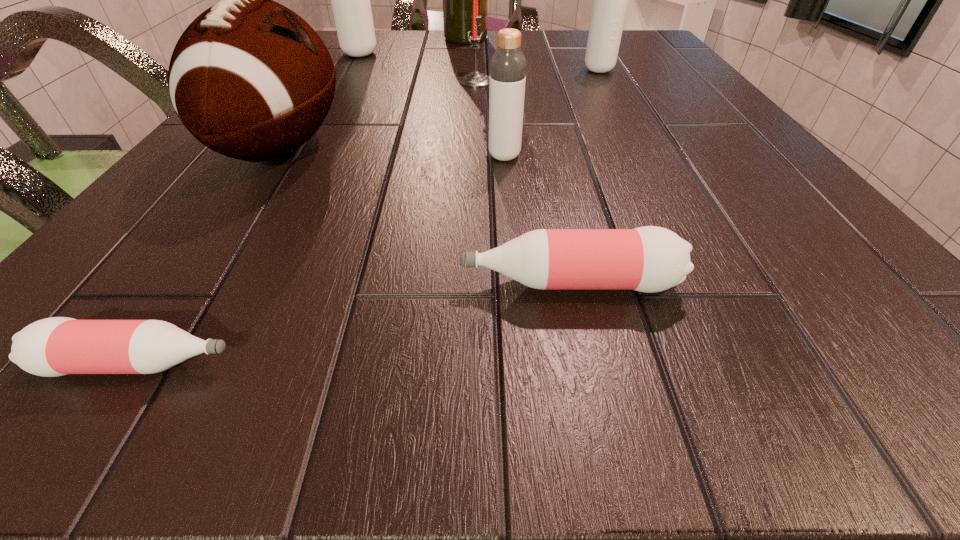
The width and height of the screenshot is (960, 540). In order to click on vacant space located with the cap open on the right pink bottle in this screenshot , I will do `click(380, 283)`.

Locate an element on the screen. free space located 0.050m with the cap open on the right pink bottle is located at coordinates (416, 283).

You are a GUI agent. You are given a task and a screenshot of the screen. Output one action in this format:
    pyautogui.click(x=<x>, y=<y>)
    Task: Click on the vacant space located 0.210m with the cap open on the right pink bottle
    
    Given the screenshot: What is the action you would take?
    272,283

This screenshot has height=540, width=960. Find the location of `free region located 0.170m with the cap open on the nearer pink bottle`. free region located 0.170m with the cap open on the nearer pink bottle is located at coordinates (417, 364).

The height and width of the screenshot is (540, 960). I want to click on wine bottle that is at the far edge, so click(457, 0).

Locate an element on the screen. Image resolution: width=960 pixels, height=540 pixels. bottle located in the far edge section of the desktop is located at coordinates (350, 0).

Locate an element on the screen. This screenshot has width=960, height=540. object located at the near edge is located at coordinates (56, 346).

Find the location of a particular element. The image size is (960, 540). football (American) that is positioned at the left edge is located at coordinates (250, 79).

Image resolution: width=960 pixels, height=540 pixels. Find the location of `object situated at the right edge`. object situated at the right edge is located at coordinates (610, 3).

I want to click on object at the far left corner, so pyautogui.click(x=350, y=0).